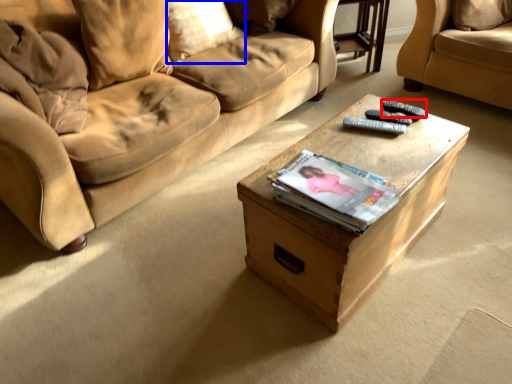
Question: Which object is closer to the camera taking this photo, remote (highlighted by a red box) or pillow (highlighted by a blue box)?

Choices:
 (A) remote
 (B) pillow

Answer: (A)